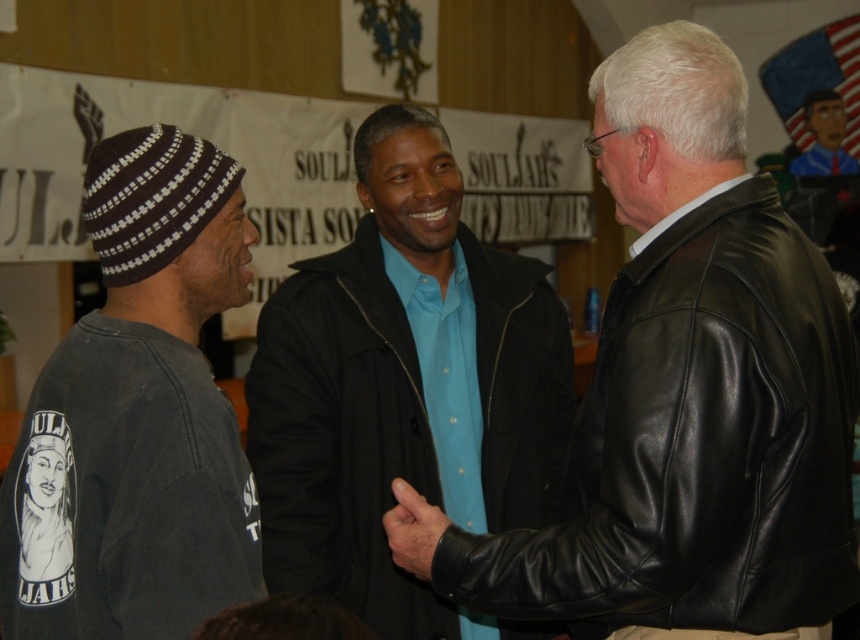
Question: Does blue matte jacket at center have a greater width compared to dark gray knit beanie at left?

Choices:
 (A) no
 (B) yes

Answer: (B)

Question: Based on their relative distances, which object is nearer to the blue matte jacket at center?

Choices:
 (A) dark gray knit beanie at left
 (B) blue shirt at center
 (C) black leather jacket at right

Answer: (C)

Question: From the image, what is the correct spatial relationship of blue matte jacket at center in relation to blue shirt at center?

Choices:
 (A) above
 (B) below

Answer: (B)

Question: Is blue matte jacket at center thinner than dark gray knit beanie at left?

Choices:
 (A) yes
 (B) no

Answer: (B)

Question: Which point is closer to the camera?

Choices:
 (A) (680, 381)
 (B) (523, 316)

Answer: (A)

Question: Estimate the real-world distances between objects in this image. Which object is farther from the blue shirt at center?

Choices:
 (A) blue matte jacket at center
 (B) black leather jacket at right
 (C) dark gray knit beanie at left

Answer: (C)